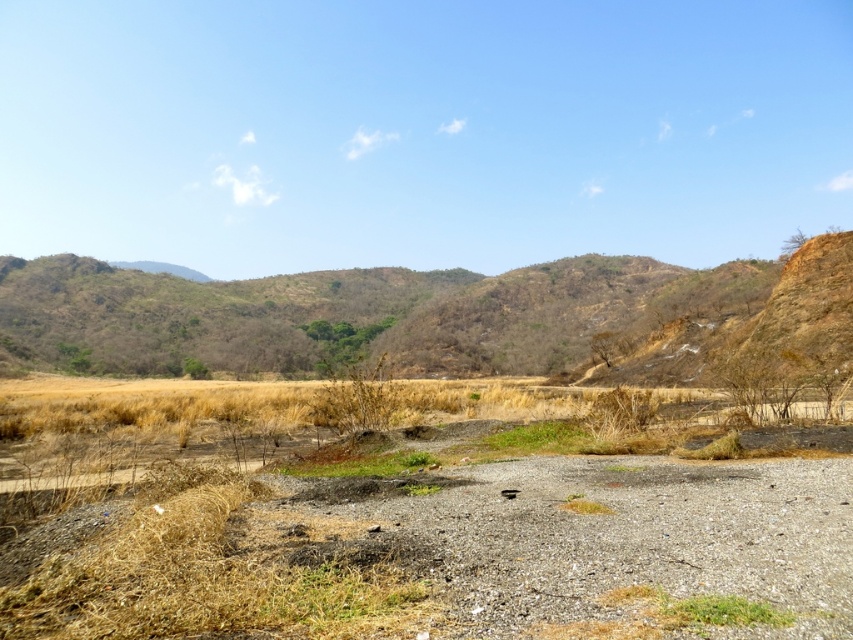
You are standing in the semi arid landscape and want to walk from point (264, 552) to point (729, 608). Which direction should you face to walk towards the point that is closer to you?

You should face towards point (264, 552) because it is closer to you than point (729, 608).

You are standing at the starting point in the landscape. There are two points marked on the terrain. The first is at coordinates point (413, 572) and the second is at point (102, 291). Which point is closer to you?

Point (413, 572) is in front of point (102, 291), so it is closer to you.